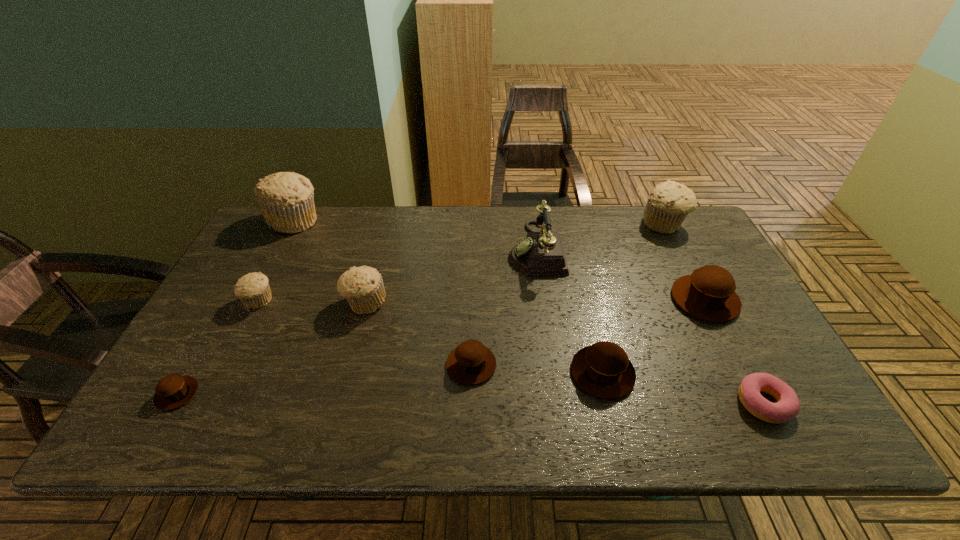
The height and width of the screenshot is (540, 960). What are the coordinates of `doughnut at the near edge` in the screenshot? It's located at (787, 407).

The width and height of the screenshot is (960, 540). Find the location of `doughnut that is at the right edge`. doughnut that is at the right edge is located at coordinates (787, 407).

You are a GUI agent. You are given a task and a screenshot of the screen. Output one action in this format:
    pyautogui.click(x=<x>, y=<y>)
    Task: Click on the object present at the far left corner
    The image size is (960, 540).
    Given the screenshot: What is the action you would take?
    pyautogui.click(x=286, y=199)

Find the location of `object at the near left corner`. object at the near left corner is located at coordinates (173, 391).

You are a GUI agent. You are given a task and a screenshot of the screen. Output one action in this format:
    pyautogui.click(x=<x>, y=<y>)
    Task: Click on the object that is positioned at the far right corner
    The image size is (960, 540).
    Given the screenshot: What is the action you would take?
    pyautogui.click(x=668, y=204)

At what (x,y) coordinates should I click in order to perform the action: click on object that is at the near right corner. Please return your answer as a coordinate pair (x, y). Looking at the image, I should click on 787,407.

In order to click on free space at the far edge of the desktop in this screenshot , I will do tap(599, 212).

I want to click on vacant region at the near edge of the desktop, so click(x=484, y=427).

Identify the location of vacant space at the right edge. This screenshot has height=540, width=960. [x=738, y=318].

In the image, there is a desktop. At what (x,y) coordinates should I click in order to perform the action: click on blank space at the far left corner. Please return your answer as a coordinate pair (x, y). The width and height of the screenshot is (960, 540). Looking at the image, I should click on (266, 245).